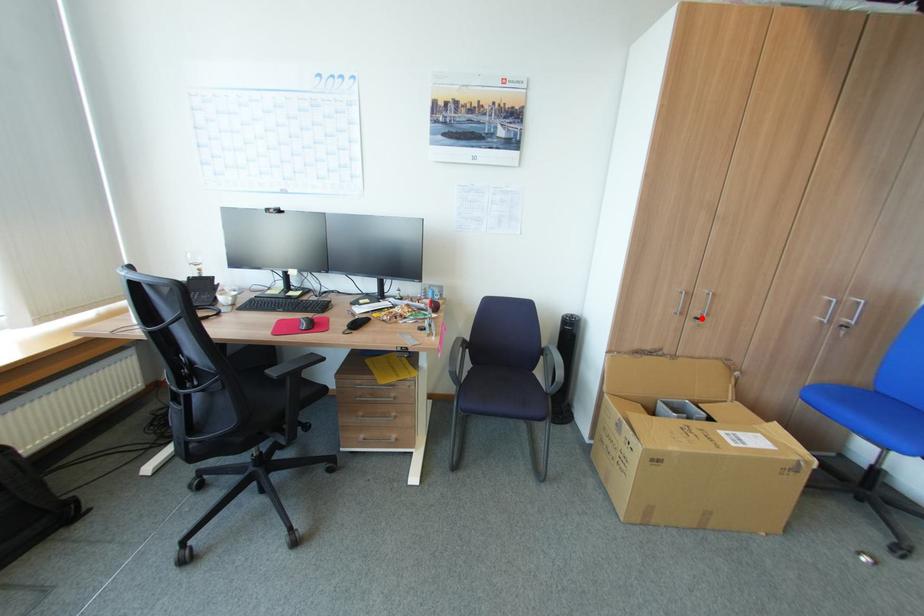
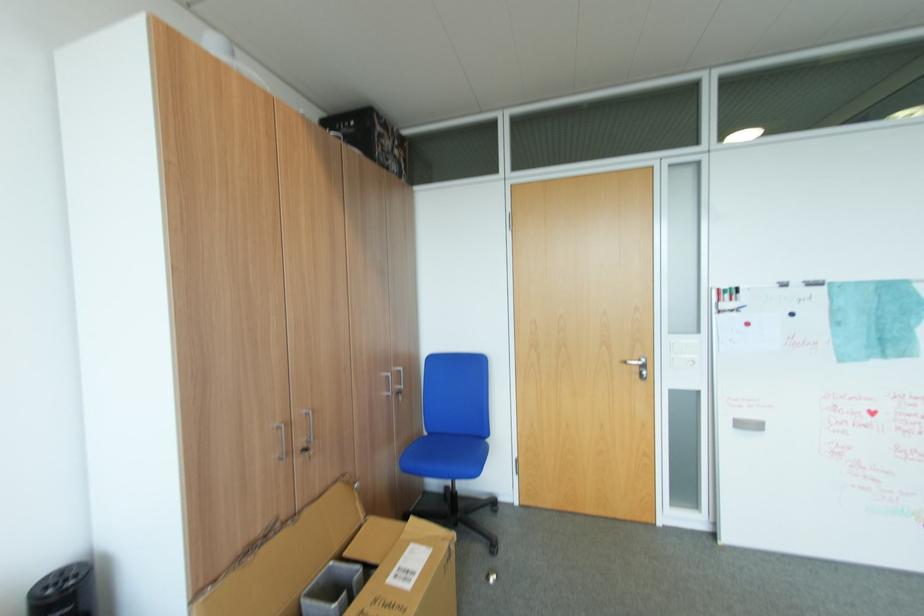
The point at the highlighted location is marked in the first image. Where is the corresponding point in the second image?

(310, 451)